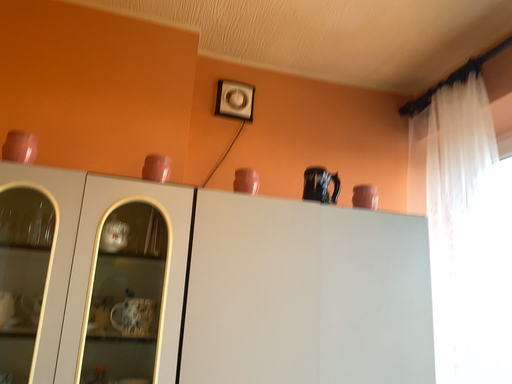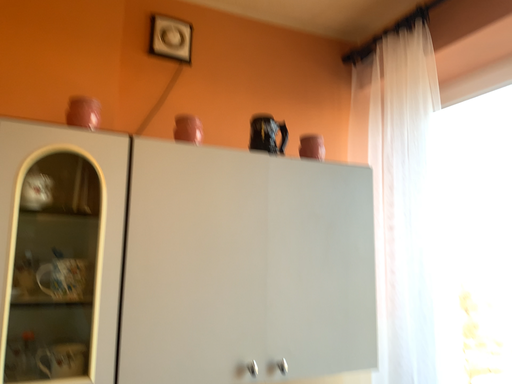
Question: How did the camera likely rotate when shooting the video?

Choices:
 (A) rotated left
 (B) rotated right

Answer: (B)